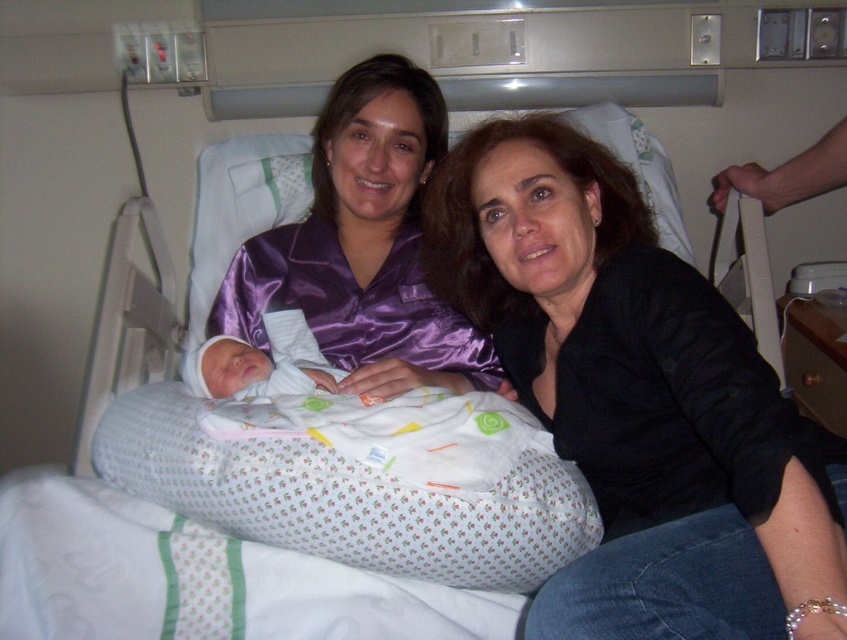
Who is higher up, black satin shirt at center or soft white swaddled newborn at center?

black satin shirt at center

Which of these two, black satin shirt at center or soft white swaddled newborn at center, stands shorter?

soft white swaddled newborn at center is shorter.

The image size is (847, 640). What do you see at coordinates (624, 348) in the screenshot?
I see `black satin shirt at center` at bounding box center [624, 348].

Find the location of `black satin shirt at center`. black satin shirt at center is located at coordinates (624, 348).

Can you confirm if black satin shirt at center is positioned above purple satin pajamas at center?

Incorrect, black satin shirt at center is not positioned above purple satin pajamas at center.

The width and height of the screenshot is (847, 640). In order to click on black satin shirt at center in this screenshot , I will do `click(624, 348)`.

Is purple satin pajamas at center above soft white swaddled newborn at center?

Indeed, purple satin pajamas at center is positioned over soft white swaddled newborn at center.

Does purple satin pajamas at center have a larger size compared to soft white swaddled newborn at center?

Yes, purple satin pajamas at center is bigger than soft white swaddled newborn at center.

Locate an element on the screen. The image size is (847, 640). purple satin pajamas at center is located at coordinates [x=364, y=244].

Find the location of a particular element. The width and height of the screenshot is (847, 640). purple satin pajamas at center is located at coordinates (364, 244).